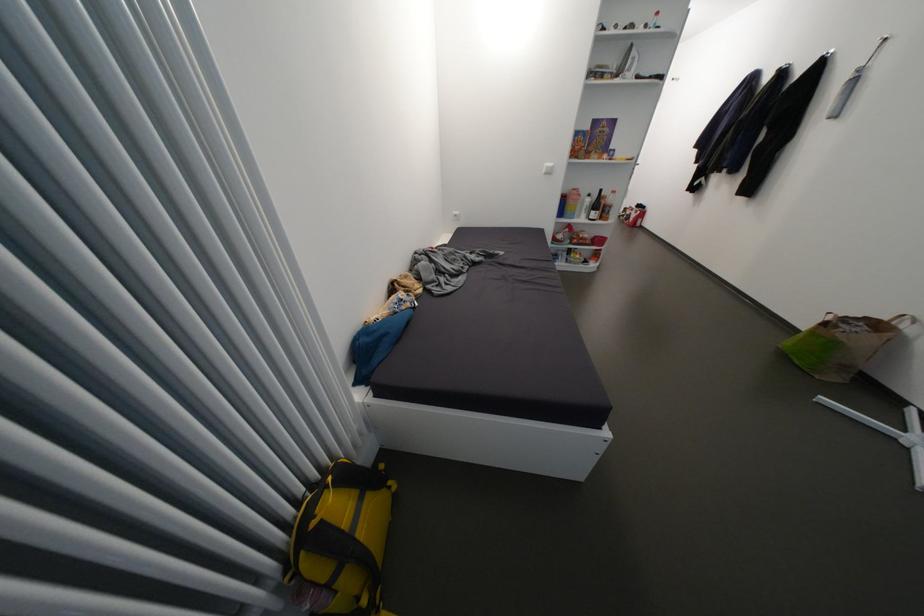
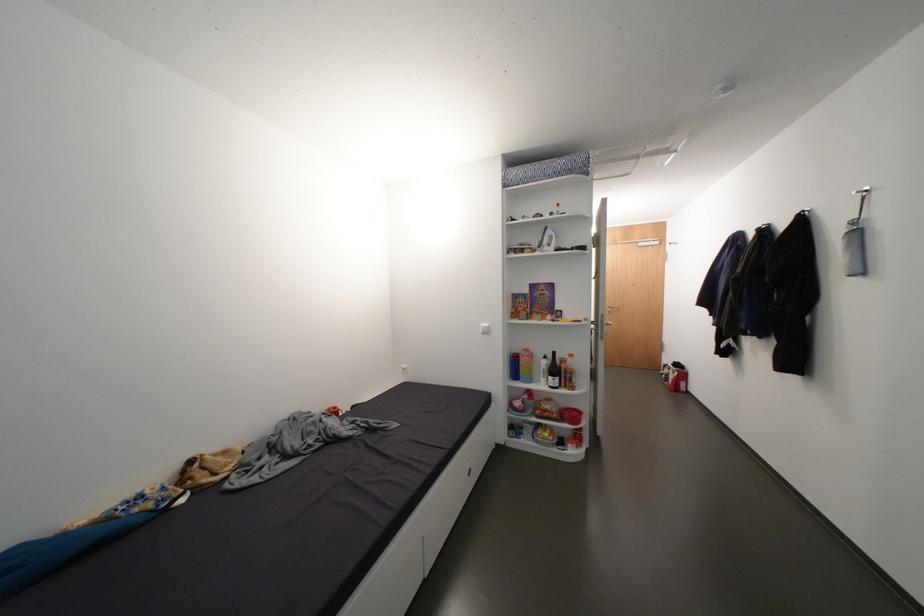
The point at (x=405, y=307) is marked in the first image. Where is the corresponding point in the second image?

(131, 508)